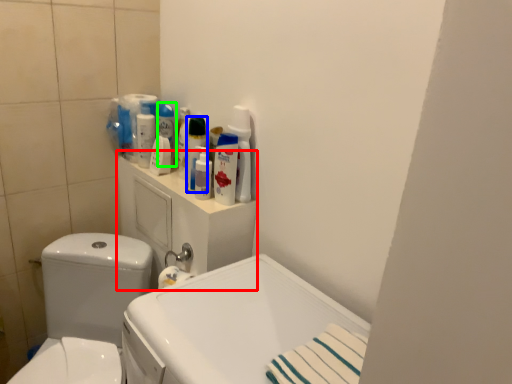
Question: Estimate the real-world distances between objects in this image. Which object is closer to medicine cabinet (highlighted by a red box), cleaning product (highlighted by a blue box) or cleaning product (highlighted by a green box)?

Choices:
 (A) cleaning product
 (B) cleaning product

Answer: (A)